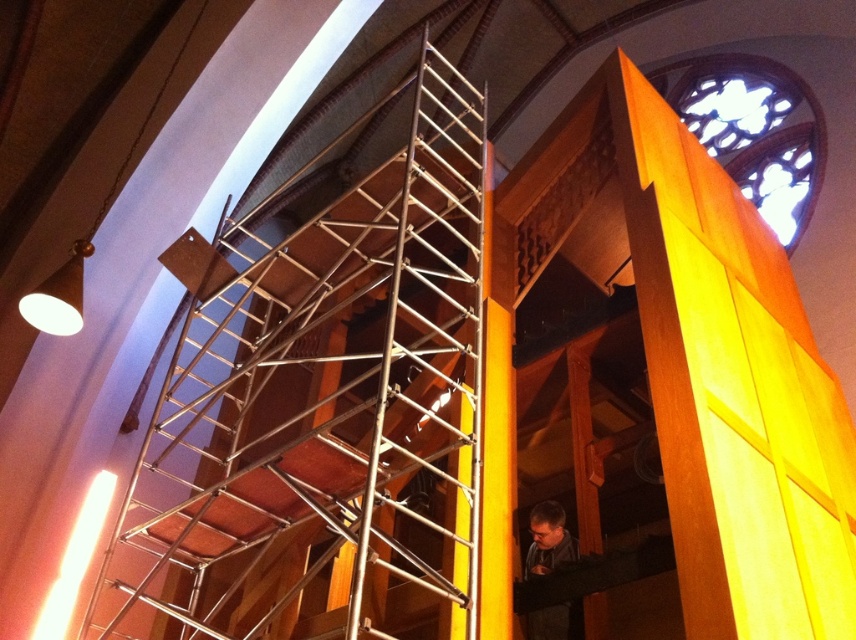
Is metallic scaffolding at center above dark gray fabric at lower right?

Yes.

Does metallic scaffolding at center have a larger size compared to dark gray fabric at lower right?

Indeed, metallic scaffolding at center has a larger size compared to dark gray fabric at lower right.

Between point (361, 332) and point (575, 621), which one is positioned behind?

Positioned behind is point (361, 332).

This screenshot has height=640, width=856. In order to click on metallic scaffolding at center in this screenshot , I will do `click(321, 406)`.